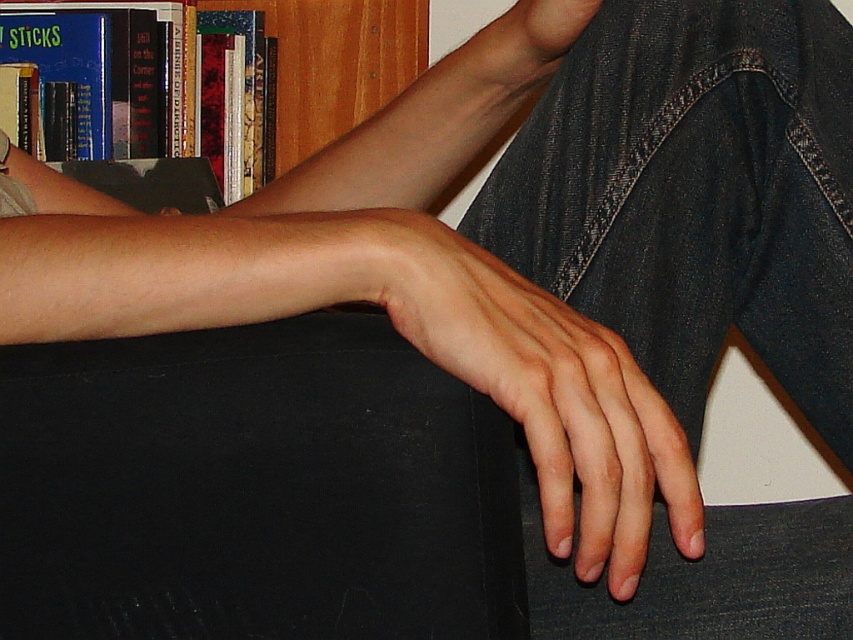
Who is positioned more to the right, dark blue denim jeans at lower right or wooden bookcase at upper left?

dark blue denim jeans at lower right

Does dark blue denim jeans at lower right appear over wooden bookcase at upper left?

No.

At what (x,y) coordinates should I click in order to perform the action: click on dark blue denim jeans at lower right. Please return your answer as a coordinate pair (x, y). The height and width of the screenshot is (640, 853). Looking at the image, I should click on (695, 195).

Is smooth skin hand at center further to the viewer compared to wooden bookcase at upper left?

That is False.

Between smooth skin hand at center and wooden bookcase at upper left, which one is positioned lower?

Positioned lower is smooth skin hand at center.

Find the location of a particular element. smooth skin hand at center is located at coordinates (543, 392).

Is point (840, 145) closer to viewer compared to point (521, 284)?

No, it is not.

Is dark blue denim jeans at lower right closer to camera compared to smooth skin hand at center?

No, dark blue denim jeans at lower right is further to the viewer.

Which is in front, point (807, 636) or point (486, 346)?

Positioned in front is point (486, 346).

Find the location of a particular element. The width and height of the screenshot is (853, 640). dark blue denim jeans at lower right is located at coordinates (695, 195).